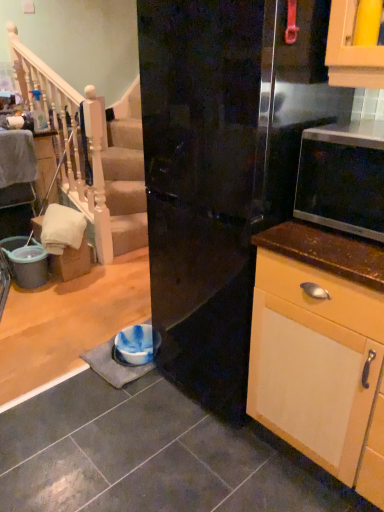
Question: Is the depth of white wood railing at upper left less than that of glossy black refrigerator at center?

Choices:
 (A) yes
 (B) no

Answer: (B)

Question: Considering the relative sizes of white wood railing at upper left and glossy black refrigerator at center in the image provided, is white wood railing at upper left wider than glossy black refrigerator at center?

Choices:
 (A) yes
 (B) no

Answer: (B)

Question: Considering the relative sizes of white wood railing at upper left and glossy black refrigerator at center in the image provided, is white wood railing at upper left smaller than glossy black refrigerator at center?

Choices:
 (A) no
 (B) yes

Answer: (B)

Question: Is white wood railing at upper left taller than glossy black refrigerator at center?

Choices:
 (A) no
 (B) yes

Answer: (B)

Question: Is white wood railing at upper left not close to glossy black refrigerator at center?

Choices:
 (A) yes
 (B) no

Answer: (A)

Question: Considering the relative positions of white wood railing at upper left and glossy black refrigerator at center in the image provided, is white wood railing at upper left behind glossy black refrigerator at center?

Choices:
 (A) yes
 (B) no

Answer: (A)

Question: Considering the relative sizes of matte black microwave at right and white wood railing at upper left in the image provided, is matte black microwave at right bigger than white wood railing at upper left?

Choices:
 (A) no
 (B) yes

Answer: (A)

Question: Can you confirm if matte black microwave at right is smaller than white wood railing at upper left?

Choices:
 (A) no
 (B) yes

Answer: (B)

Question: Can you see matte black microwave at right touching white wood railing at upper left?

Choices:
 (A) no
 (B) yes

Answer: (A)

Question: Is matte black microwave at right aimed at white wood railing at upper left?

Choices:
 (A) yes
 (B) no

Answer: (B)

Question: From a real-world perspective, does matte black microwave at right sit lower than white wood railing at upper left?

Choices:
 (A) yes
 (B) no

Answer: (B)

Question: Considering the relative positions of matte black microwave at right and white wood railing at upper left in the image provided, is matte black microwave at right to the right of white wood railing at upper left from the viewer's perspective?

Choices:
 (A) no
 (B) yes

Answer: (B)

Question: From a real-world perspective, is glossy black refrigerator at center below white wood railing at upper left?

Choices:
 (A) no
 (B) yes

Answer: (B)